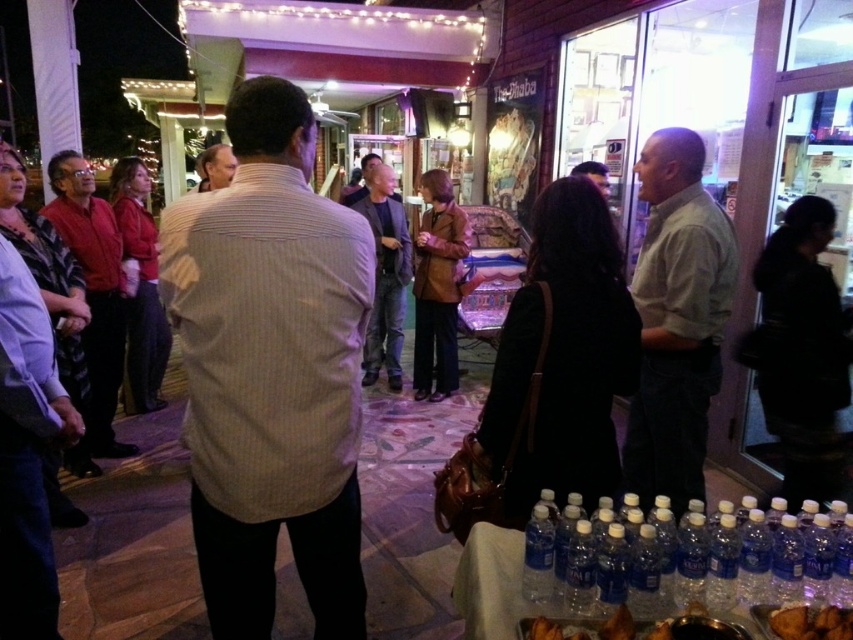
You are standing at the entrance of The Shaba and want to walk towards the first point you see. Which point, point (326, 589) or point (392, 362), is closer to you?

Point (326, 589) is in front of point (392, 362), so it is closer to you.

You are at the event and want to grab a drink and a snack. You see the clear plastic bottles at lower right and the brown crispy bread at lower right. Which item is wider?

The clear plastic bottles at lower right might be wider than brown crispy bread at lower right, so the clear plastic bottles at lower right could be wider.